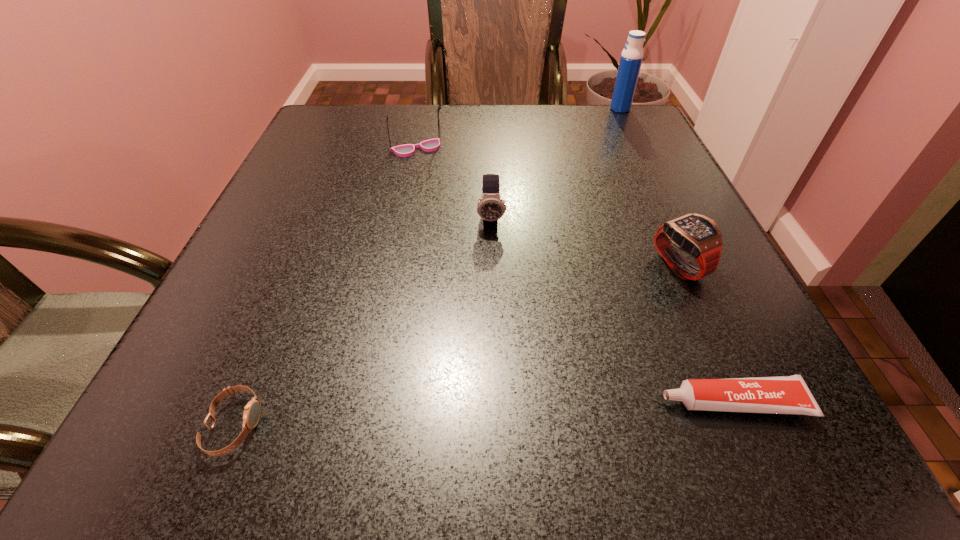
Identify the location of spectacles that is at the far edge. The image size is (960, 540). (430, 145).

This screenshot has width=960, height=540. What are the coordinates of `toothpaste that is at the near edge` in the screenshot? It's located at (788, 394).

This screenshot has height=540, width=960. I want to click on watch positioned at the near edge, so click(x=252, y=411).

The width and height of the screenshot is (960, 540). Identify the location of object present at the left edge. (252, 411).

Image resolution: width=960 pixels, height=540 pixels. Find the location of `water bottle that is at the right edge`. water bottle that is at the right edge is located at coordinates (631, 58).

Where is `watch that is positioned at the right edge`? watch that is positioned at the right edge is located at coordinates (697, 235).

The width and height of the screenshot is (960, 540). Identify the location of toothpaste positioned at the right edge. (788, 394).

Locate an element on the screen. Image resolution: width=960 pixels, height=540 pixels. object located in the near left corner section of the desktop is located at coordinates (252, 411).

The image size is (960, 540). Identify the location of object positioned at the far right corner. (631, 58).

Identify the location of object located at the near right corner. [x=788, y=394].